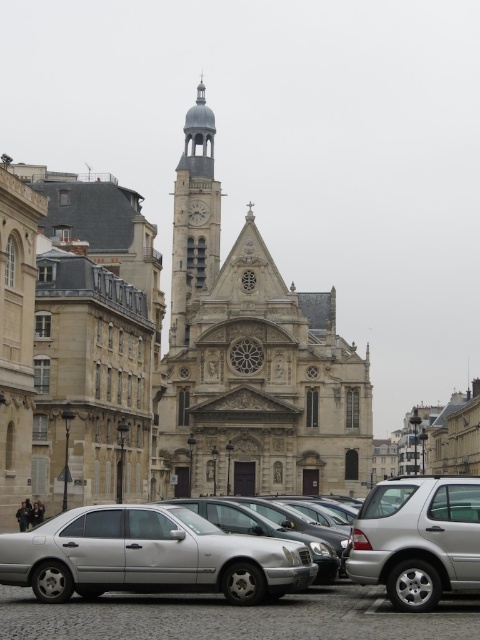
You are standing at the center of the cobblestone street in front of the historic church. If you want to take a photo of the stone church at center from the best angle, where should you position yourself relative to the church?

The best angle to photograph the stone church at center would be directly in front of it, aligned with its central axis, as this position will capture the full facade and architectural details symmetrically.

You are standing in front of the historic church and want to take a photo. You notice two points marked in the scene. One is at point coordinate (186,380) and the other at point coordinate (41,602). Which point is closer to you, the photographer?

Point coordinate (186,380) is closer to you because it is further to the viewer than point coordinate (41,602).

You are standing on the cobblestone street in front of the stone church at center. You want to take a photo of the church with your smartphone held at eye level. Will the silver metallic car at lower right block the view of the church dome?

The stone church at center is much taller than the silver metallic car at lower right, so the dome of the church should still be visible above the car when taking the photo.